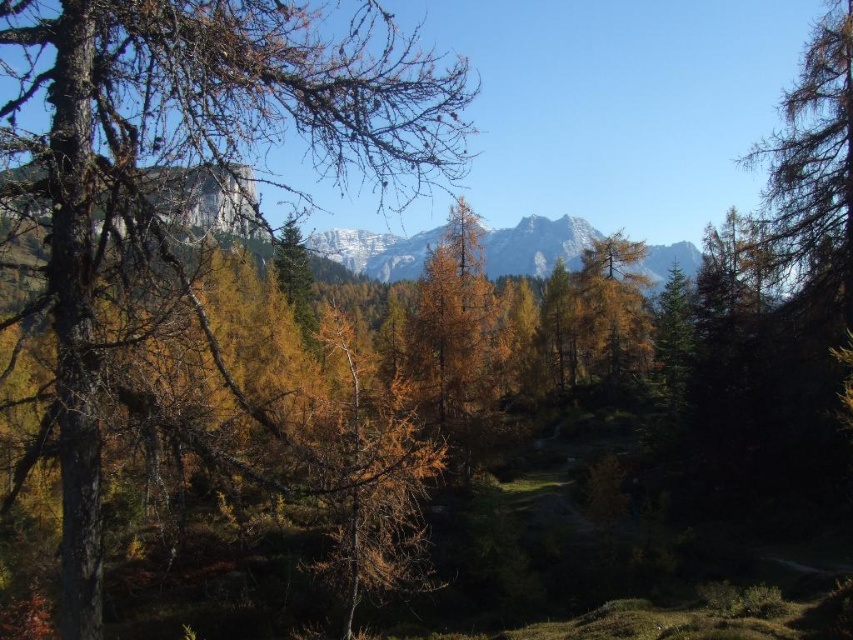
Question: Which of the following is the farthest from the observer?

Choices:
 (A) (117, 38)
 (B) (650, 346)

Answer: (B)

Question: Is brown rough bark tree at left thinner than yellow matte tree at center?

Choices:
 (A) no
 (B) yes

Answer: (A)

Question: Can you confirm if brown rough bark tree at left is wider than yellow matte tree at center?

Choices:
 (A) yes
 (B) no

Answer: (A)

Question: Which of the following is the farthest from the observer?

Choices:
 (A) brown rough bark tree at left
 (B) yellow matte tree at center

Answer: (B)

Question: Which point is closer to the camera taking this photo?

Choices:
 (A) (222, 97)
 (B) (596, 240)

Answer: (A)

Question: Is brown rough bark tree at left behind yellow matte tree at center?

Choices:
 (A) no
 (B) yes

Answer: (A)